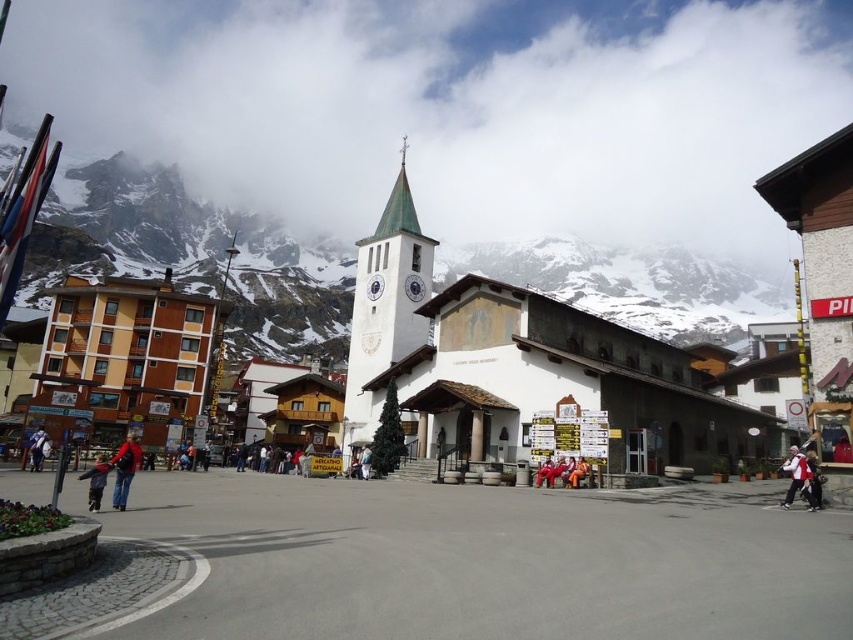
Can you confirm if snowy rock at upper center is thinner than blue denim jacket at lower left?

Incorrect, snowy rock at upper center's width is not less than blue denim jacket at lower left's.

Is point (763, 307) positioned before point (93, 481)?

No, (763, 307) is further to viewer.

Identify the location of snowy rock at upper center. Image resolution: width=853 pixels, height=640 pixels. (190, 253).

Can you confirm if yellow wood building at left is positioned to the left of blue denim jacket at lower left?

Indeed, yellow wood building at left is positioned on the left side of blue denim jacket at lower left.

Who is positioned more to the right, yellow wood building at left or blue denim jacket at lower left?

blue denim jacket at lower left is more to the right.

Where is `yellow wood building at left`? This screenshot has width=853, height=640. yellow wood building at left is located at coordinates (126, 358).

Is white smooth clock tower at center to the right of denim pants at lower left from the viewer's perspective?

Correct, you'll find white smooth clock tower at center to the right of denim pants at lower left.

Does white smooth clock tower at center have a lesser height compared to denim pants at lower left?

In fact, white smooth clock tower at center may be taller than denim pants at lower left.

The width and height of the screenshot is (853, 640). I want to click on white smooth clock tower at center, so click(x=386, y=304).

Where is `white smooth clock tower at center`? The height and width of the screenshot is (640, 853). white smooth clock tower at center is located at coordinates (386, 304).